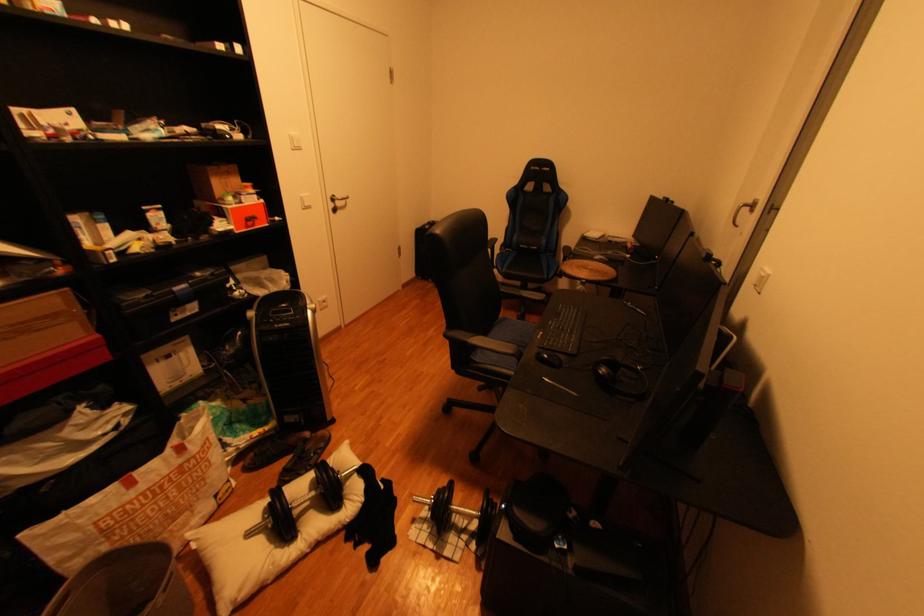
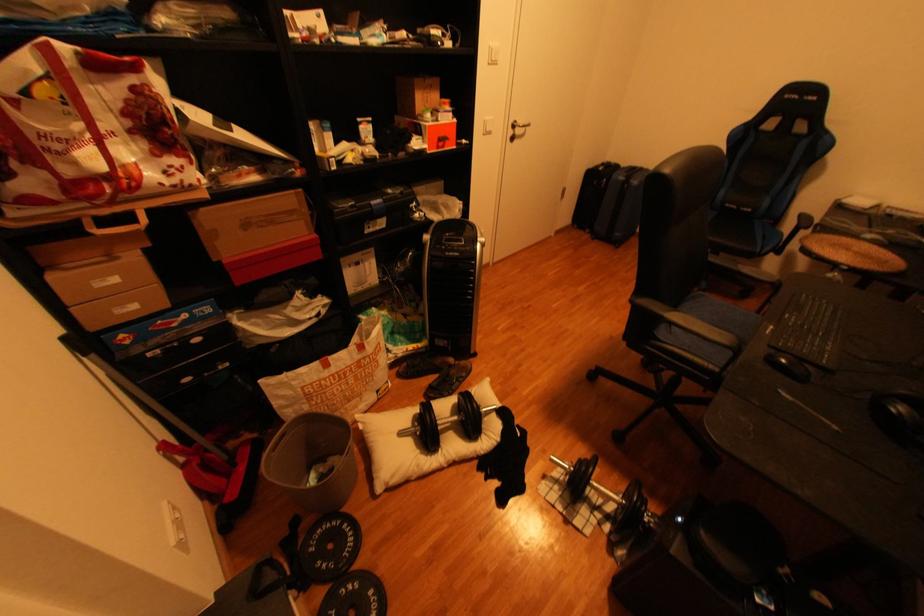
Question: The images are taken continuously from a first-person perspective. In which direction is your viewpoint rotating?

Choices:
 (A) Left
 (B) Right
 (C) Up
 (D) Down

Answer: (A)